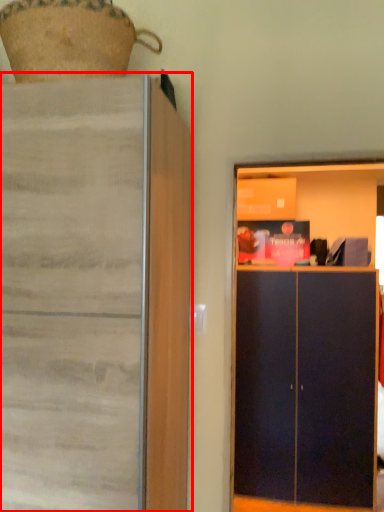
Question: From the image's perspective, considering the relative positions of cupboard (annotated by the red box) and dresser in the image provided, where is cupboard (annotated by the red box) located with respect to the staircase?

Choices:
 (A) above
 (B) below

Answer: (A)